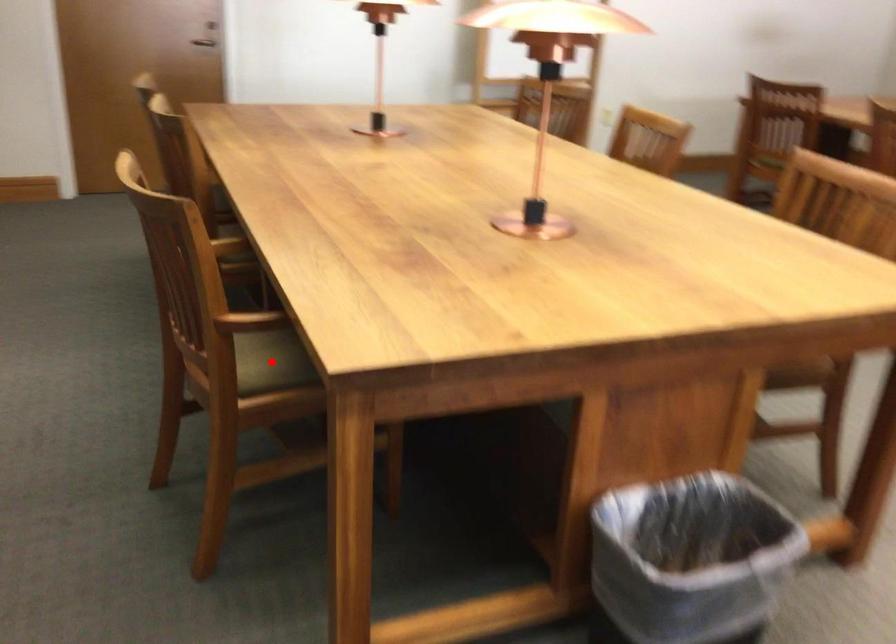
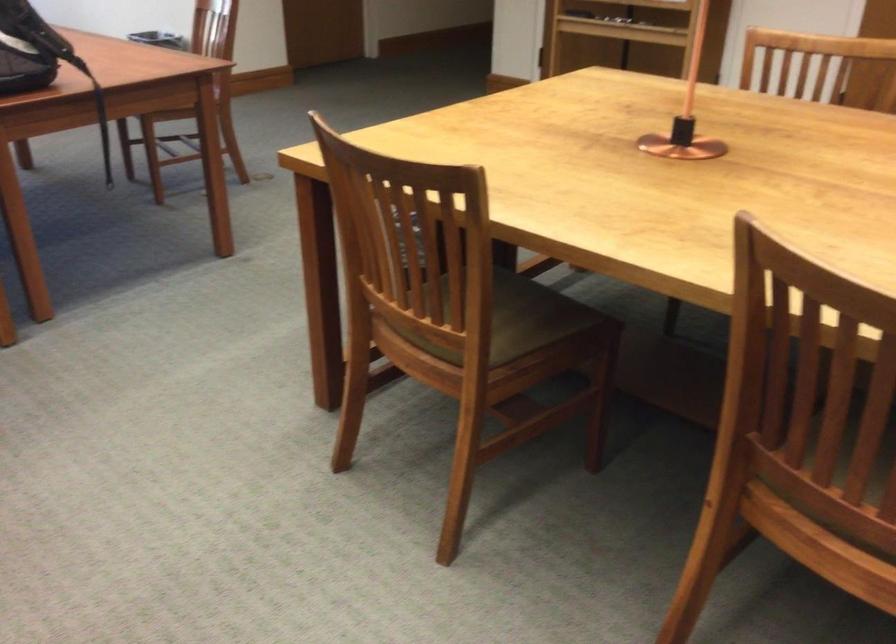
Question: I am providing you with two images of the same scene from different viewpoints. A red point is marked on the first image. Can you still see the location of the red point in image 2?

Choices:
 (A) Yes
 (B) No

Answer: (B)